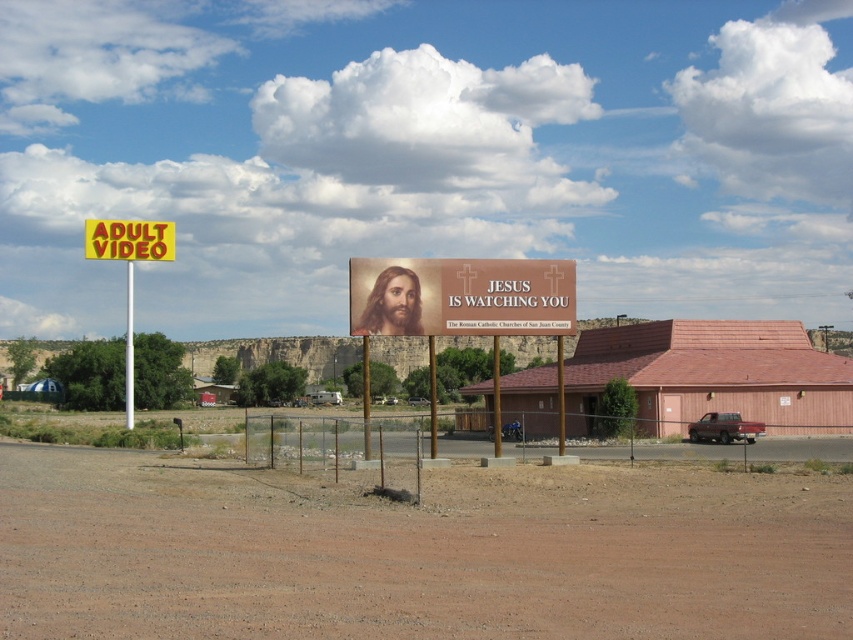
You are a hiker who has just arrived at this rural roadside scene. You notice the brown sandy dirt at center and the yellow plastic sign at left. Which object is positioned lower from your viewpoint?

The brown sandy dirt at center is located below the yellow plastic sign at left, so it is positioned lower from your viewpoint.

You are driving a car that is 15 feet long. You see the yellow plastic sign at left and the billboard in the middle ground. Can your car fit between them without touching either?

The yellow plastic sign at left and the billboard in the middle ground are 208.45 feet apart. Since your car is only 15 feet long, it can easily fit between them without touching either.

You are standing at the point labeled as point (410, 556) in the image. What is the material you are standing on?

The point (410, 556) indicates brown sandy dirt at center, so you are standing on brown sandy dirt.